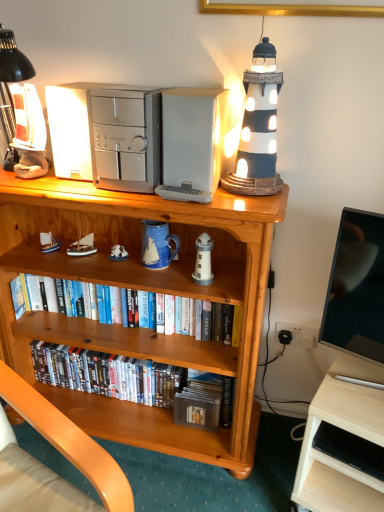
Question: From a real-world perspective, relative to white ceramic figurine at center, which ranks as the first toy in back-to-front order, is hardcover books at center, which ranks as the second book in top-to-bottom order, vertically above or below?

Choices:
 (A) below
 (B) above

Answer: (A)

Question: From their relative heights in the image, would you say hardcover books at center, which is counted as the first book, starting from the bottom, is taller or shorter than white ceramic figurine at center, the second toy in the left-to-right sequence?

Choices:
 (A) short
 (B) tall

Answer: (B)

Question: Which object is the closest to the white plastic microwave at upper center, which is the 1th appliance from right to left?

Choices:
 (A) satin silver computer tower at upper center, placed as the 2th appliance when sorted from left to right
 (B) white wood desk at lower right
 (C) satin silver appliance at upper left, positioned as the 1th appliance in left-to-right order
 (D) hardcover books at center, which ranks as the second book in top-to-bottom order
 (E) white matte sailboat at upper left, marked as the 1th toy in a left-to-right arrangement

Answer: (A)

Question: Which of these objects is positioned farthest from the matte black lighthouse at upper right?

Choices:
 (A) hardcover books at center, which ranks as the second book in top-to-bottom order
 (B) white ceramic figurine at center, which is the third toy in front-to-back order
 (C) blue ceramic mug at center
 (D) satin silver computer tower at upper center, the second appliance in the right-to-left sequence
 (E) white matte sailboat at upper left, marked as the 1th toy in a left-to-right arrangement

Answer: (A)